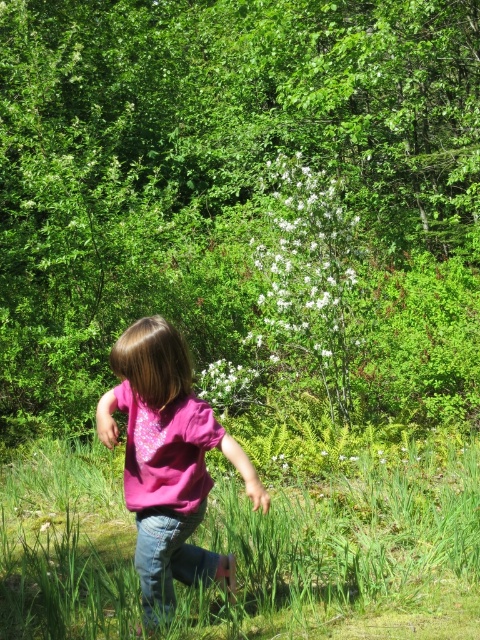
You are a photographer trying to capture the child in the scene. The pink cotton shirt at center and the white matte flower at center are both in focus. Which object is closer to the camera?

The pink cotton shirt at center is closer to the viewer than the white matte flower at center, so the pink cotton shirt at center would be in focus closer to the camera.

You are a photographer trying to capture a closeup of the white matte flower at center without the pink cotton shirt at center blocking the view. Is it possible to position yourself so that the flower is fully visible while the shirt is not?

The pink cotton shirt at center might be wider than white matte flower at center, so there is a possibility that the flower could be blocked depending on their exact sizes and positions. To ensure the flower is fully visible, you might need to adjust your angle or distance to frame the shot carefully.